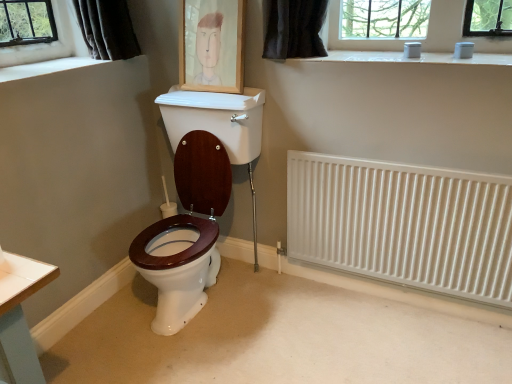
Where is `free area below white metallic radiator at right (from a real-world perspective)`? The image size is (512, 384). free area below white metallic radiator at right (from a real-world perspective) is located at coordinates (381, 295).